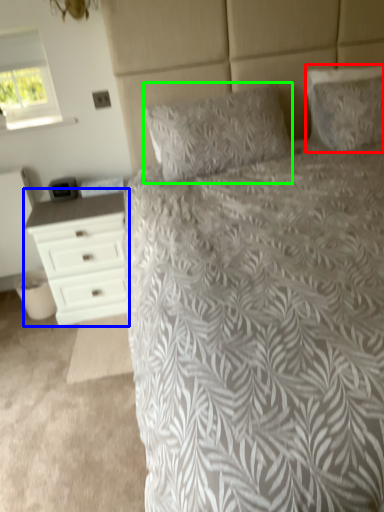
Question: Based on their relative distances, which object is farther from pillow (highlighted by a red box)? Choose from chest of drawers (highlighted by a blue box) and pillow (highlighted by a green box).

Choices:
 (A) chest of drawers
 (B) pillow

Answer: (A)